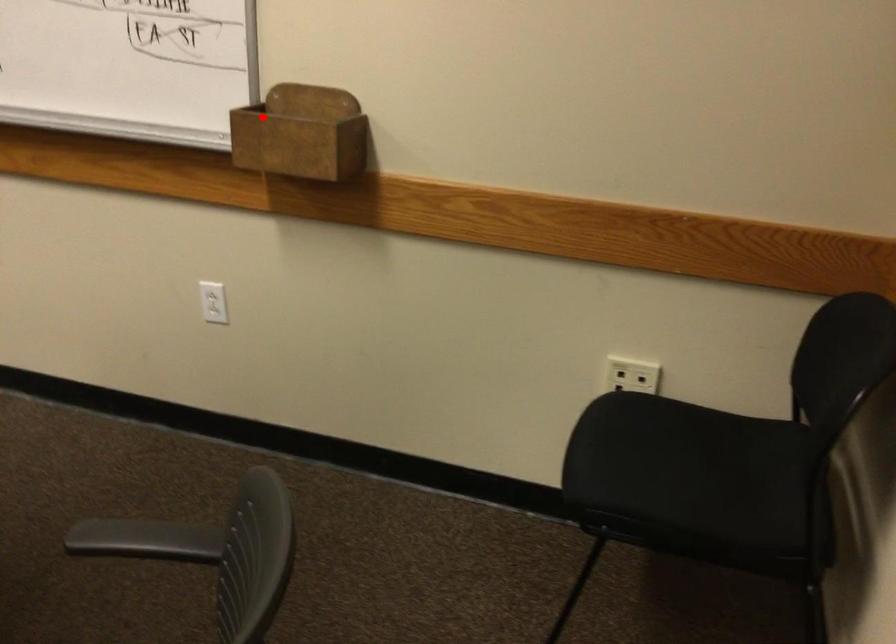
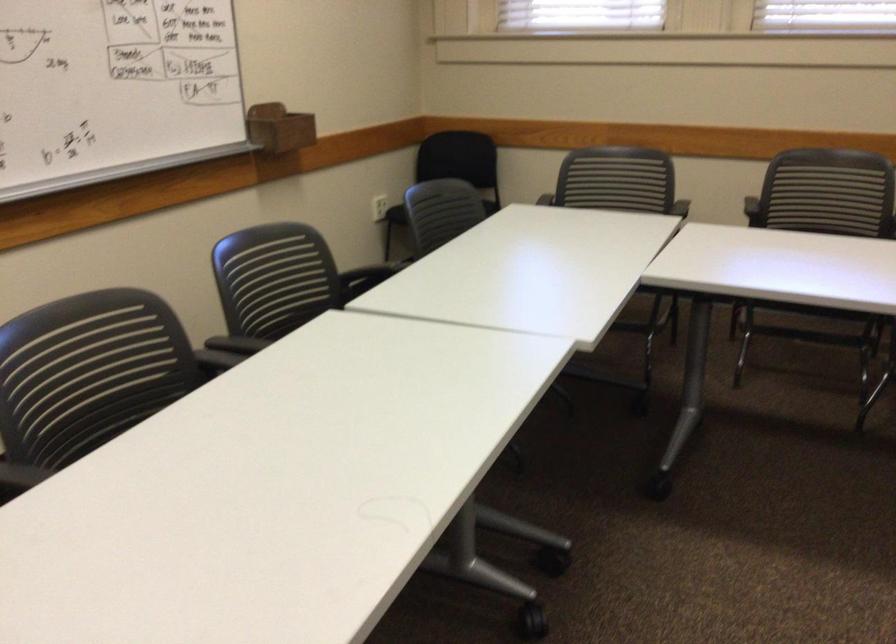
Locate, in the second image, the point that corresponds to the highlighted location in the first image.

(279, 128)